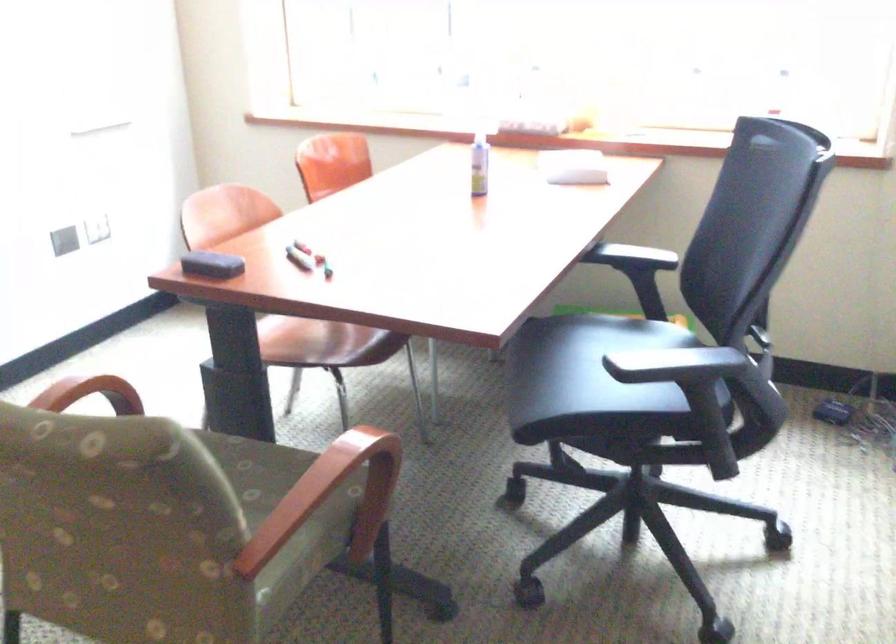
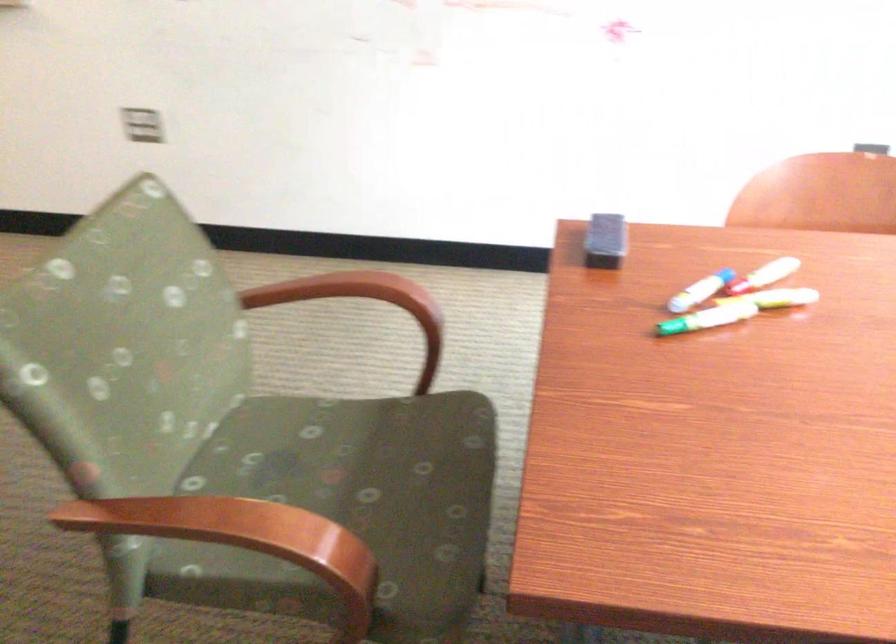
Where in the second image is the point corresponding to point 303,257 from the first image?

(700, 290)